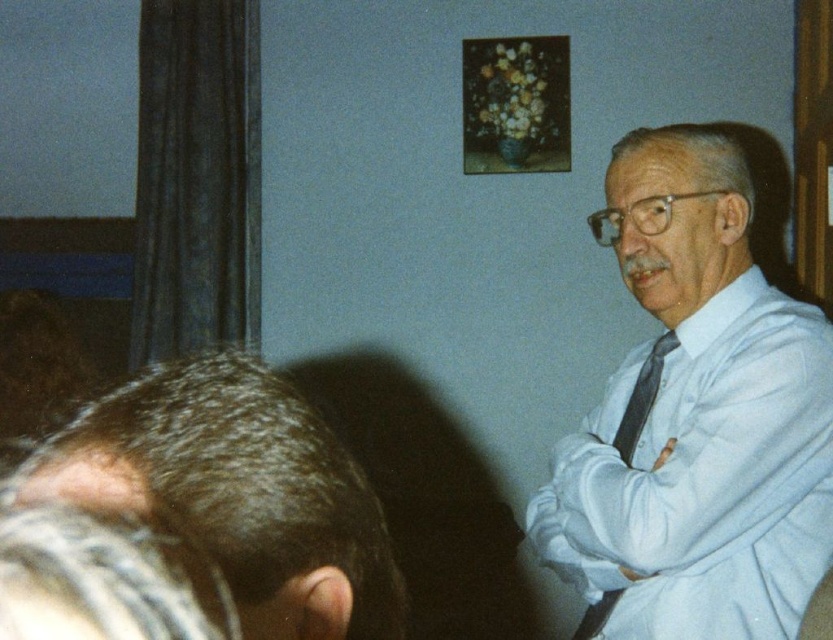
Question: Considering the real-world distances, which object is closest to the gray hair at lower left?

Choices:
 (A) black silk tie at right
 (B) white shirt at center

Answer: (B)

Question: Does white shirt at center have a smaller size compared to gray hair at lower left?

Choices:
 (A) no
 (B) yes

Answer: (A)

Question: Which of the following is the farthest from the observer?

Choices:
 (A) (227, 420)
 (B) (147, 588)
 (C) (791, 500)
 (D) (632, 401)

Answer: (D)

Question: Does white shirt at center have a larger size compared to black silk tie at right?

Choices:
 (A) yes
 (B) no

Answer: (A)

Question: Where is dark brown hair at lower left located in relation to gray hair at lower left in the image?

Choices:
 (A) above
 (B) below

Answer: (B)

Question: Estimate the real-world distances between objects in this image. Which object is farther from the dark brown hair at lower left?

Choices:
 (A) gray hair at lower left
 (B) white shirt at center
 (C) black silk tie at right

Answer: (C)